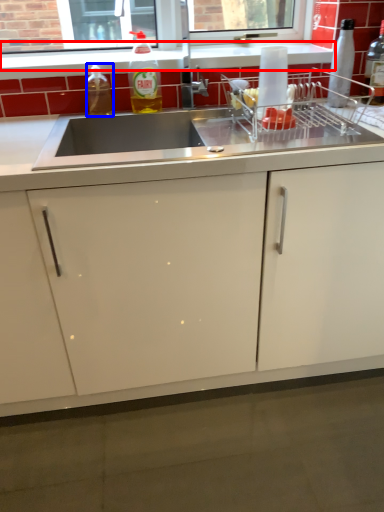
Question: Among these objects, which one is nearest to the camera, window sill (highlighted by a red box) or bottle (highlighted by a blue box)?

Choices:
 (A) window sill
 (B) bottle

Answer: (B)